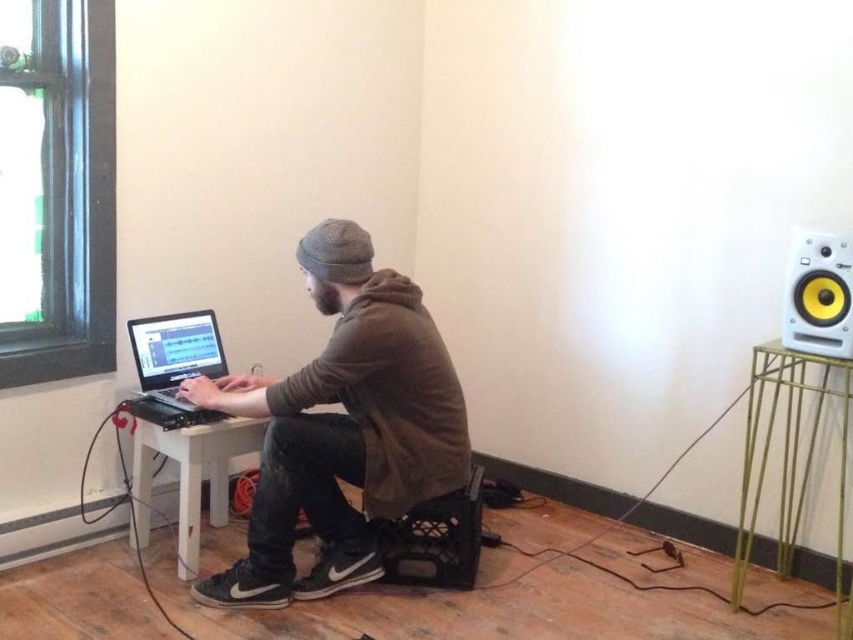
Can you confirm if brown matte hoodie at center is shorter than white plastic speaker at upper right?

No.

Looking at this image, between brown matte hoodie at center and white plastic speaker at upper right, which one has less height?

With less height is white plastic speaker at upper right.

Locate an element on the screen. The height and width of the screenshot is (640, 853). brown matte hoodie at center is located at coordinates 341,428.

Where is `brown matte hoodie at center`? The image size is (853, 640). brown matte hoodie at center is located at coordinates (341, 428).

Is point (218, 499) farther from viewer compared to point (810, 289)?

Yes, it is.

Between white wood table at lower left and white plastic speaker at upper right, which one is positioned higher?

Positioned higher is white plastic speaker at upper right.

Is point (141, 422) behind point (846, 266)?

Yes, point (141, 422) is behind point (846, 266).

You are a GUI agent. You are given a task and a screenshot of the screen. Output one action in this format:
    pyautogui.click(x=<x>, y=<y>)
    Task: Click on the white wood table at lower left
    The height and width of the screenshot is (640, 853).
    Given the screenshot: What is the action you would take?
    pyautogui.click(x=190, y=474)

Who is more distant from viewer, (798, 456) or (195, 337)?

Positioned behind is point (195, 337).

Which is below, gold metal table at right or black matte laptop at left?

Positioned lower is gold metal table at right.

You are a GUI agent. You are given a task and a screenshot of the screen. Output one action in this format:
    pyautogui.click(x=<x>, y=<y>)
    Task: Click on the gold metal table at right
    
    Given the screenshot: What is the action you would take?
    pyautogui.click(x=792, y=458)